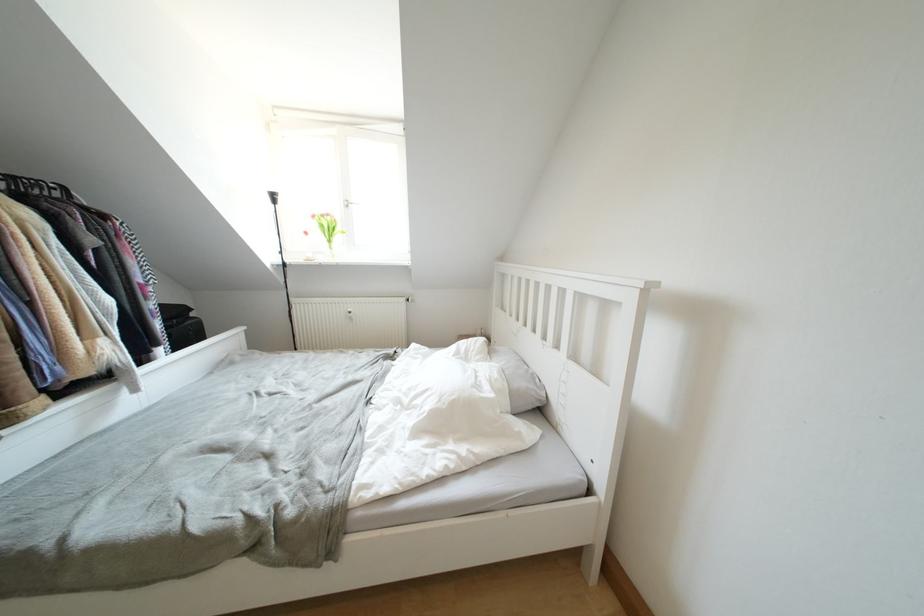
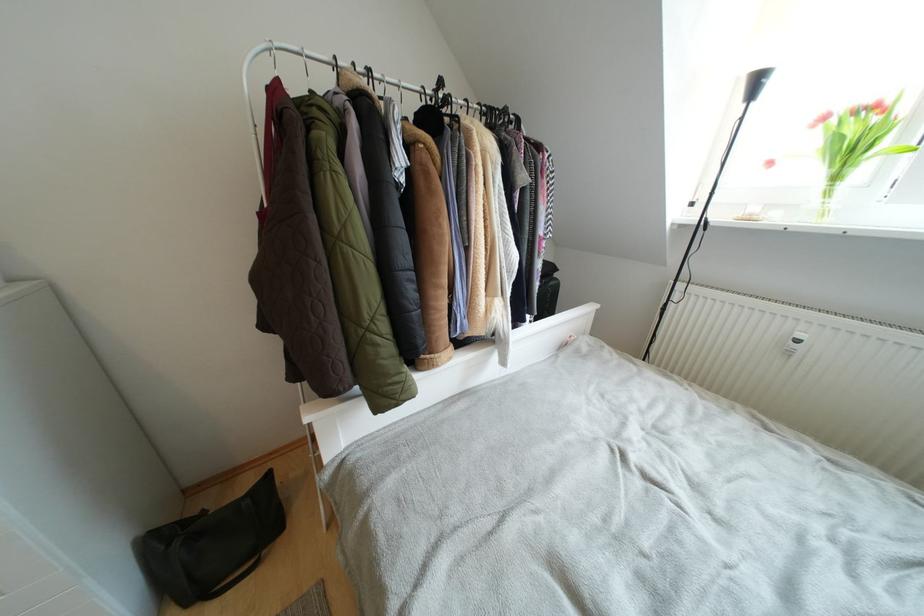
Locate, in the second image, the point that corresponds to point 334,246 in the first image.

(840, 182)